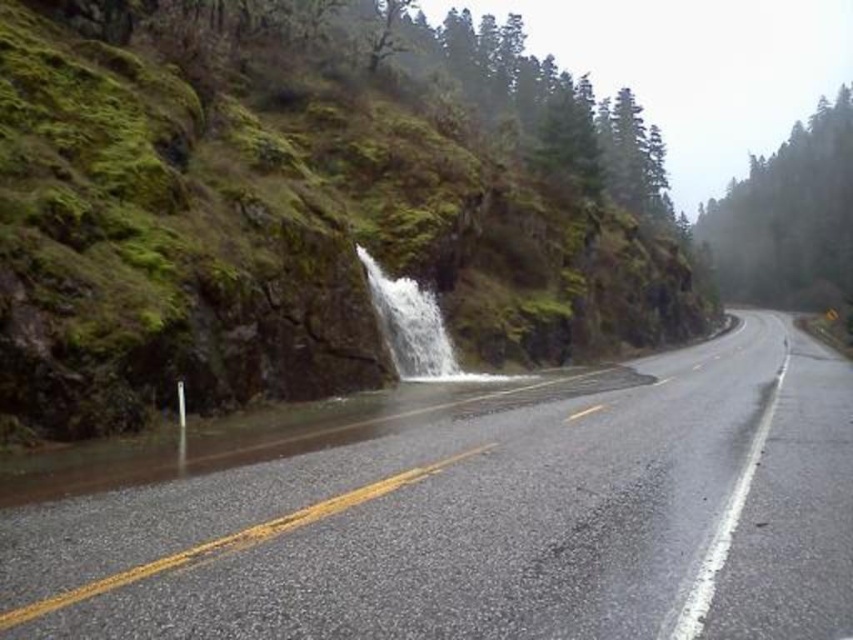
Question: Which point is closer to the camera?

Choices:
 (A) (173, 552)
 (B) (125, 170)

Answer: (A)

Question: Which point is closer to the camera?

Choices:
 (A) glossy asphalt highway at center
 (B) green mossy rock at center

Answer: (A)

Question: Estimate the real-world distances between objects in this image. Which object is farther from the clear water at center?

Choices:
 (A) green mossy rock at center
 (B) glossy asphalt highway at center

Answer: (A)

Question: From the image, what is the correct spatial relationship of green mossy rock at center in relation to clear water at center?

Choices:
 (A) above
 (B) below

Answer: (A)

Question: Observing the image, what is the correct spatial positioning of green mossy rock at center in reference to glossy asphalt highway at center?

Choices:
 (A) below
 (B) above

Answer: (B)

Question: Can you confirm if glossy asphalt highway at center is wider than clear water at center?

Choices:
 (A) yes
 (B) no

Answer: (A)